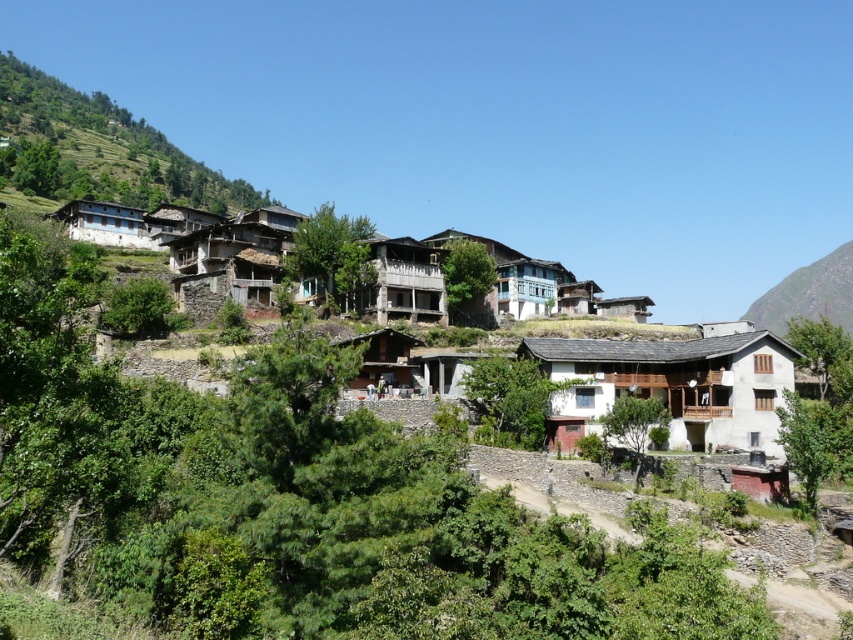
Question: Does rustic stone houses at upper center appear over rugged stone mountain at upper right?

Choices:
 (A) no
 (B) yes

Answer: (B)

Question: Does rustic stone houses at upper center have a greater width compared to rugged stone mountain at upper right?

Choices:
 (A) yes
 (B) no

Answer: (A)

Question: Which of the following is the farthest from the observer?

Choices:
 (A) rustic stone houses at center
 (B) rugged stone mountain at upper right

Answer: (B)

Question: Which is farther from the rustic stone houses at upper center?

Choices:
 (A) rugged stone mountain at upper right
 (B) rustic stone houses at center

Answer: (A)

Question: Does rustic stone houses at upper center appear over rugged stone mountain at upper right?

Choices:
 (A) yes
 (B) no

Answer: (A)

Question: Among these points, which one is farthest from the camera?

Choices:
 (A) (740, 365)
 (B) (166, 205)

Answer: (B)